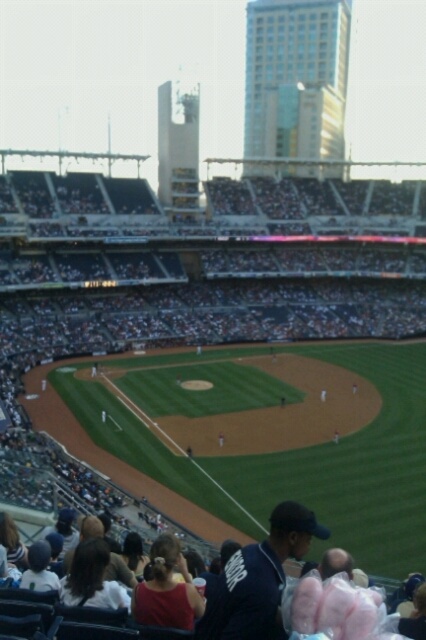
Is point (213, 310) positioned in front of point (213, 634)?

That is False.

The image size is (426, 640). Describe the element at coordinates (204, 268) in the screenshot. I see `dark blue jersey at center` at that location.

Locate an element on the screen. dark blue jersey at center is located at coordinates (204, 268).

Which of these two, dark blue jersey at center or matte red shirt at lower center, stands shorter?

matte red shirt at lower center is shorter.

Between point (161, 216) and point (152, 564), which one is positioned in front?

Point (152, 564) is more forward.

Is point (218, 182) positioned before point (173, 614)?

That is False.

Image resolution: width=426 pixels, height=640 pixels. Find the location of `dark blue jersey at center`. dark blue jersey at center is located at coordinates (204, 268).

Is dark blue jersey at lower center further to the viewer compared to matte red shirt at lower center?

No, it is not.

Can you confirm if dark blue jersey at lower center is shorter than matte red shirt at lower center?

In fact, dark blue jersey at lower center may be taller than matte red shirt at lower center.

Is point (273, 513) closer to camera compared to point (170, 608)?

No.

Where is `dark blue jersey at lower center`? dark blue jersey at lower center is located at coordinates (259, 579).